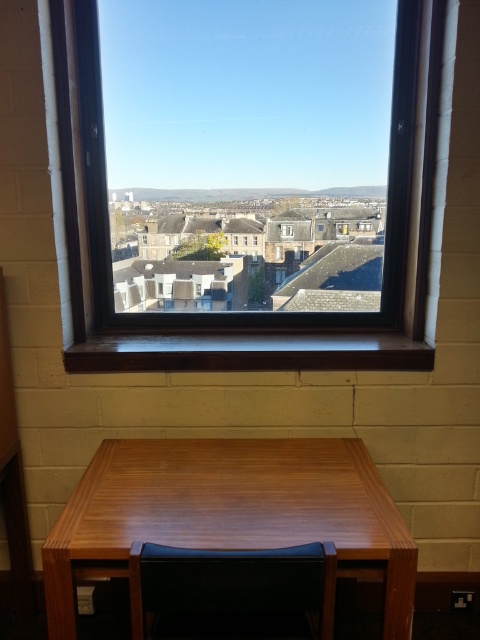
Question: Is wooden table at center to the left of black leather chair at lower center from the viewer's perspective?

Choices:
 (A) yes
 (B) no

Answer: (A)

Question: Can you confirm if black leather chair at lower center is positioned to the right of clear glass window at center?

Choices:
 (A) no
 (B) yes

Answer: (A)

Question: Among these objects, which one is nearest to the camera?

Choices:
 (A) dark wood frame at center
 (B) wooden table at center

Answer: (B)

Question: Considering the real-world distances, which object is farthest from the wooden table at center?

Choices:
 (A) black leather chair at lower center
 (B) dark wood frame at center

Answer: (B)

Question: Can you confirm if black leather chair at lower center is positioned to the right of clear glass window at center?

Choices:
 (A) no
 (B) yes

Answer: (A)

Question: Which object is the farthest from the black leather chair at lower center?

Choices:
 (A) dark wood frame at center
 (B) wooden table at center

Answer: (A)